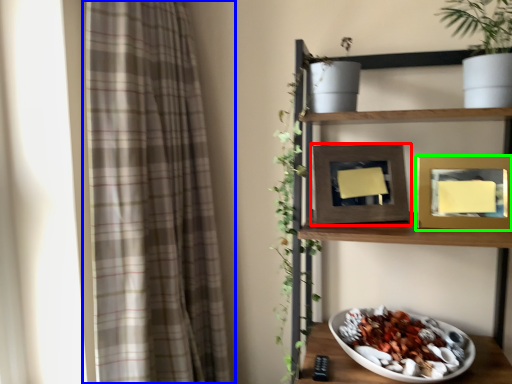
Question: Which object is positioned farthest from picture frame (highlighted by a red box)? Select from curtain (highlighted by a blue box) and picture frame (highlighted by a green box).

Choices:
 (A) curtain
 (B) picture frame

Answer: (A)